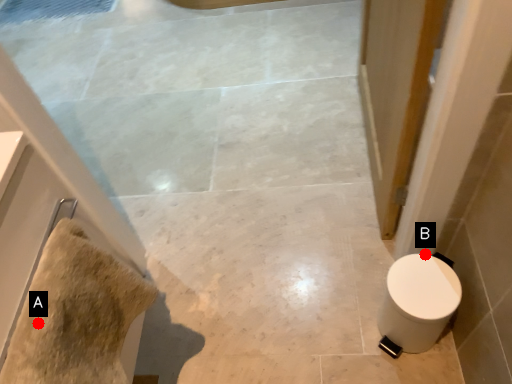
Question: Two points are circled on the image, labeled by A and B beside each circle. Among these points, which one is nearest to the camera?

Choices:
 (A) A is closer
 (B) B is closer

Answer: (A)